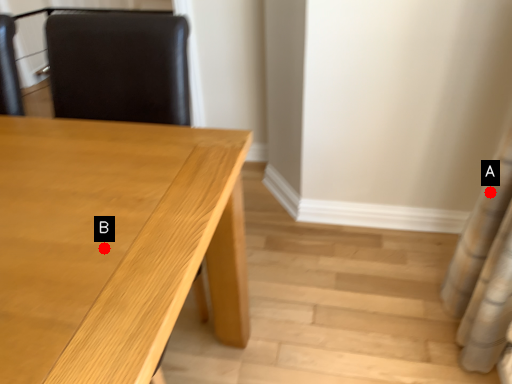
Question: Two points are circled on the image, labeled by A and B beside each circle. Which point is closer to the camera?

Choices:
 (A) A is closer
 (B) B is closer

Answer: (B)